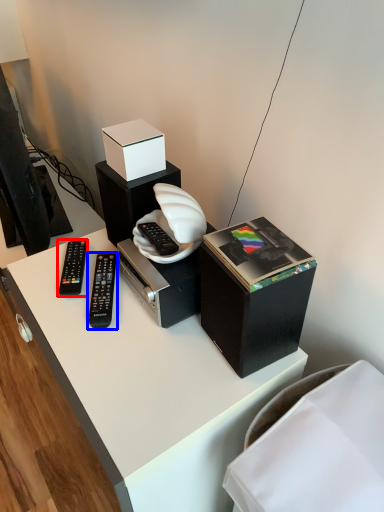
Question: Which of the following is the farthest to the observer, remote control (highlighted by a red box) or remote control (highlighted by a blue box)?

Choices:
 (A) remote control
 (B) remote control

Answer: (A)